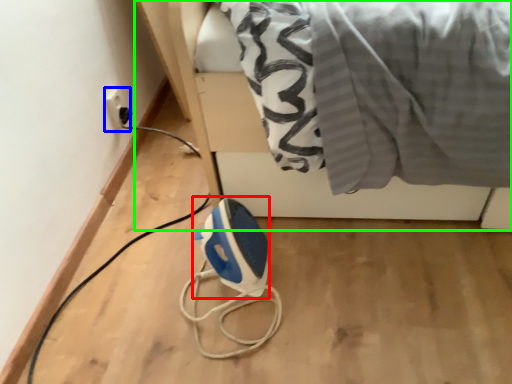
Question: Which object is the farthest from appliance (highlighted by a red box)? Choose among these: electric outlet (highlighted by a blue box) or furniture (highlighted by a green box).

Choices:
 (A) electric outlet
 (B) furniture

Answer: (A)